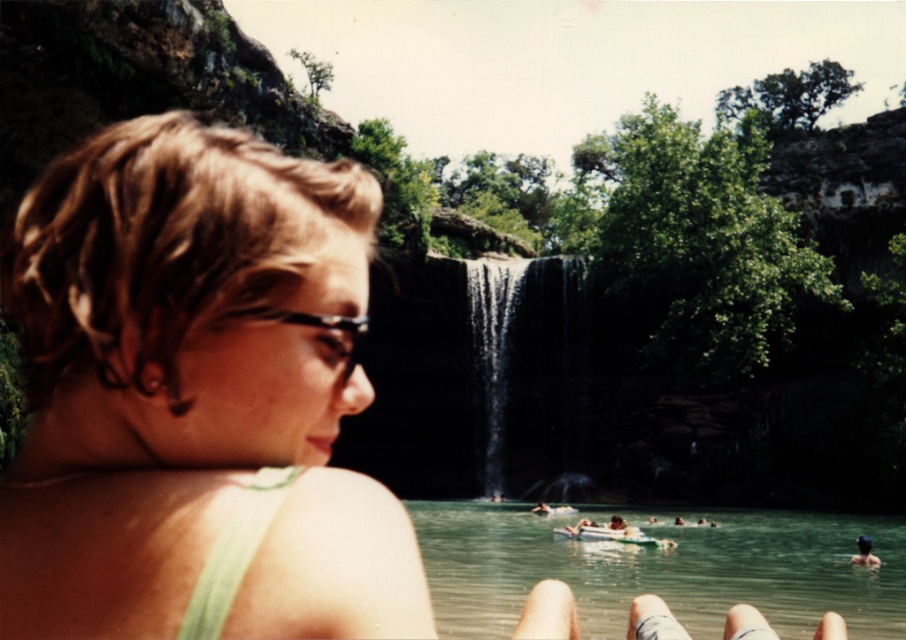
Question: Which point appears farthest from the camera in this image?

Choices:
 (A) (439, 604)
 (B) (246, 454)

Answer: (A)

Question: In this image, where is green water at lower center located relative to black glossy waterfall at center?

Choices:
 (A) below
 (B) above

Answer: (A)

Question: Is green water at lower center thinner than black glossy waterfall at center?

Choices:
 (A) no
 (B) yes

Answer: (A)

Question: Which object is the closest to the green fabric bikini top at center?

Choices:
 (A) black glossy waterfall at center
 (B) green water at lower center

Answer: (B)

Question: Which point is closer to the camera?

Choices:
 (A) (451, 595)
 (B) (326, 397)

Answer: (B)

Question: Does green fabric bikini top at center appear under black glossy waterfall at center?

Choices:
 (A) yes
 (B) no

Answer: (B)